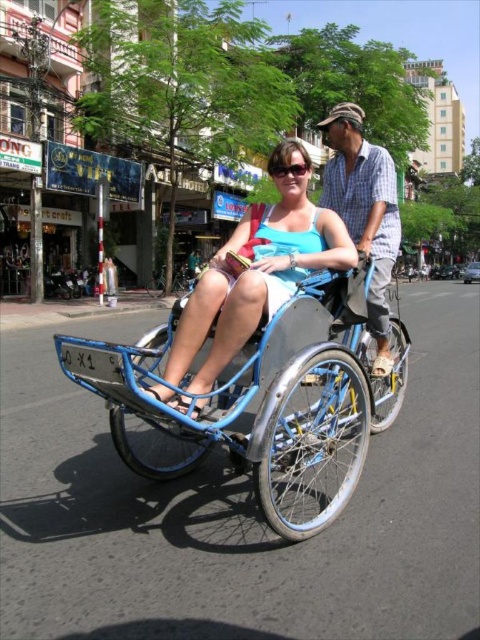
Can you confirm if blue metallic tricycle at center is bigger than clear plastic goggles at center?

Yes.

Which is below, blue metallic tricycle at center or clear plastic goggles at center?

blue metallic tricycle at center is lower down.

You are a GUI agent. You are given a task and a screenshot of the screen. Output one action in this format:
    pyautogui.click(x=<x>, y=<y>)
    Task: Click on the blue metallic tricycle at center
    The width and height of the screenshot is (480, 640).
    Given the screenshot: What is the action you would take?
    pyautogui.click(x=264, y=392)

This screenshot has width=480, height=640. In order to click on blue metallic tricycle at center in this screenshot , I will do `click(264, 392)`.

What do you see at coordinates (253, 276) in the screenshot? The height and width of the screenshot is (640, 480). I see `matte blue wheelchair at center` at bounding box center [253, 276].

Who is lower down, matte blue wheelchair at center or clear plastic goggles at center?

Positioned lower is matte blue wheelchair at center.

Image resolution: width=480 pixels, height=640 pixels. I want to click on matte blue wheelchair at center, so click(x=253, y=276).

Is the position of blue metallic tricycle at center more distant than that of blue plaid shirt at center?

No, blue metallic tricycle at center is in front of blue plaid shirt at center.

Can you confirm if blue metallic tricycle at center is positioned to the left of blue plaid shirt at center?

Indeed, blue metallic tricycle at center is positioned on the left side of blue plaid shirt at center.

Image resolution: width=480 pixels, height=640 pixels. I want to click on blue metallic tricycle at center, so click(264, 392).

This screenshot has width=480, height=640. In order to click on blue metallic tricycle at center in this screenshot , I will do `click(264, 392)`.